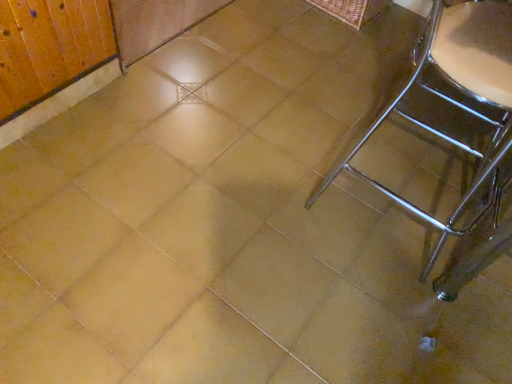
Where is `free space in front of polished chrome chair at right`? The image size is (512, 384). free space in front of polished chrome chair at right is located at coordinates (388, 308).